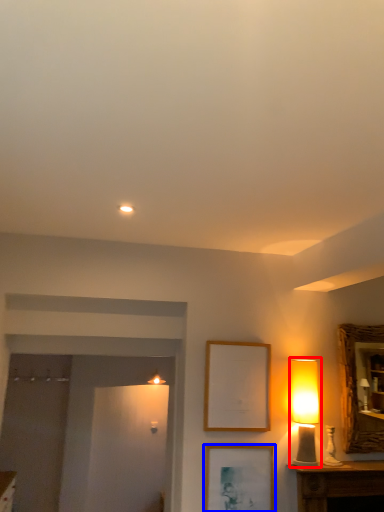
Question: Which object is closer to the camera taking this photo, table lamp (highlighted by a red box) or picture frame (highlighted by a blue box)?

Choices:
 (A) table lamp
 (B) picture frame

Answer: (B)